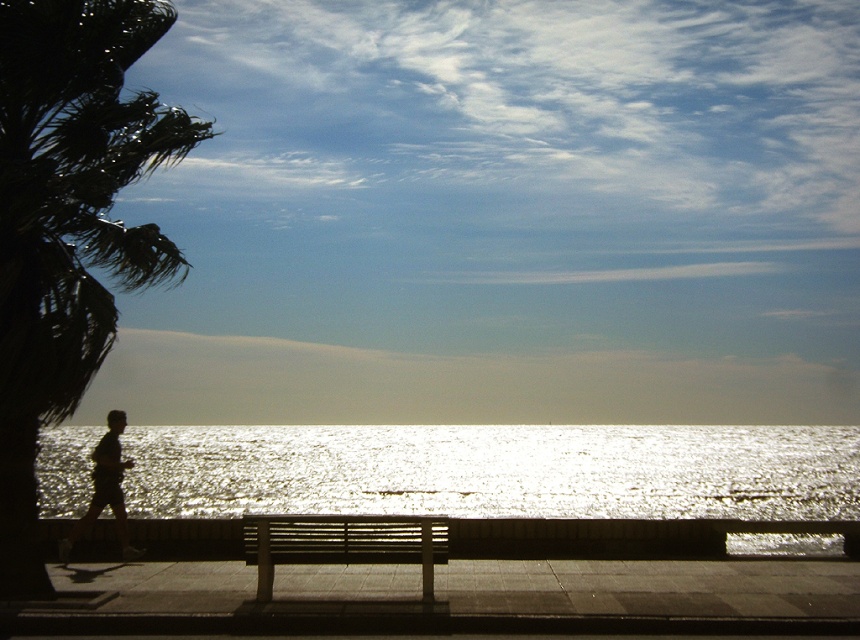
You are a photographer wanting to capture the entire view of the glistening silver water at center and the wooden slats bench at center in a single frame. Based on their sizes, which one will occupy more space in your photo?

The glistening silver water at center occupies more space in the photo because it is larger than the wooden slats bench at center.

You are a photographer standing at the edge of the walkway and want to capture a photo of the wooden slats bench at center and the glistening silver water at center. Which object appears larger in the photo?

The glistening silver water at center appears larger in the photo because it is taller than the wooden slats bench at center.

You are standing on the walkway and want to sit on the wooden bench. You notice the green leafy palm tree at left and the dark silhouette figure at left. Which object is closer to you, the palm tree or the figure?

The green leafy palm tree at left is bigger than the dark silhouette figure at left, so the palm tree is closer to you because larger objects in the foreground appear bigger than those in the background.